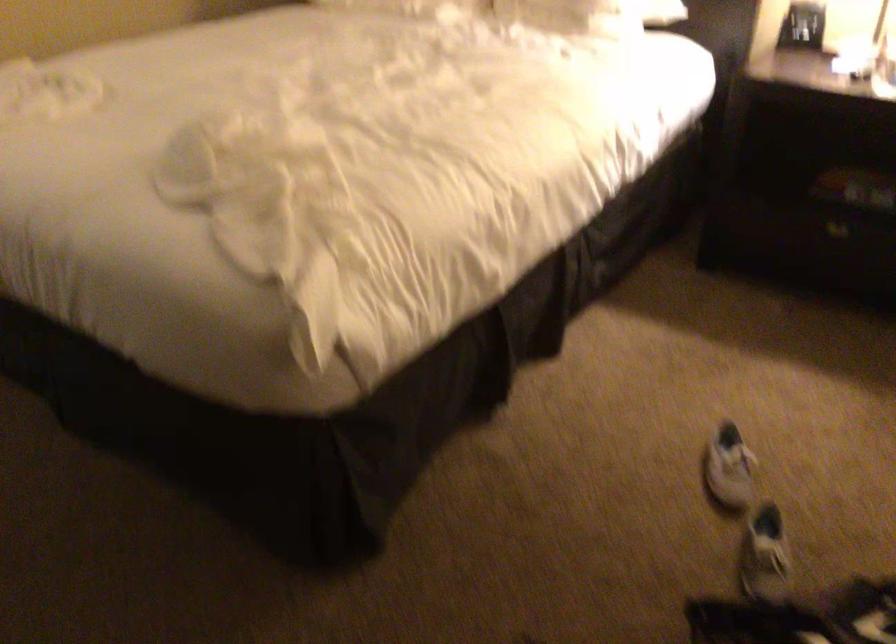
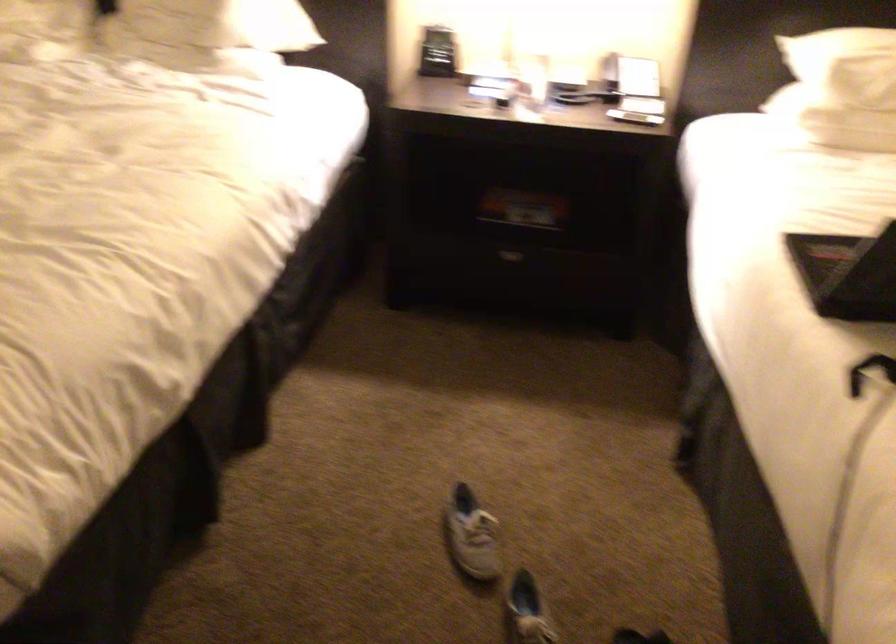
Locate, in the second image, the point that corresponds to the point at 731,468 in the first image.

(470, 535)